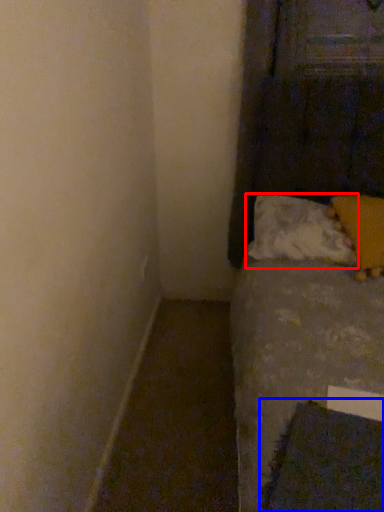
Question: Which object is further to the camera taking this photo, pillow (highlighted by a red box) or sheet (highlighted by a blue box)?

Choices:
 (A) pillow
 (B) sheet

Answer: (A)